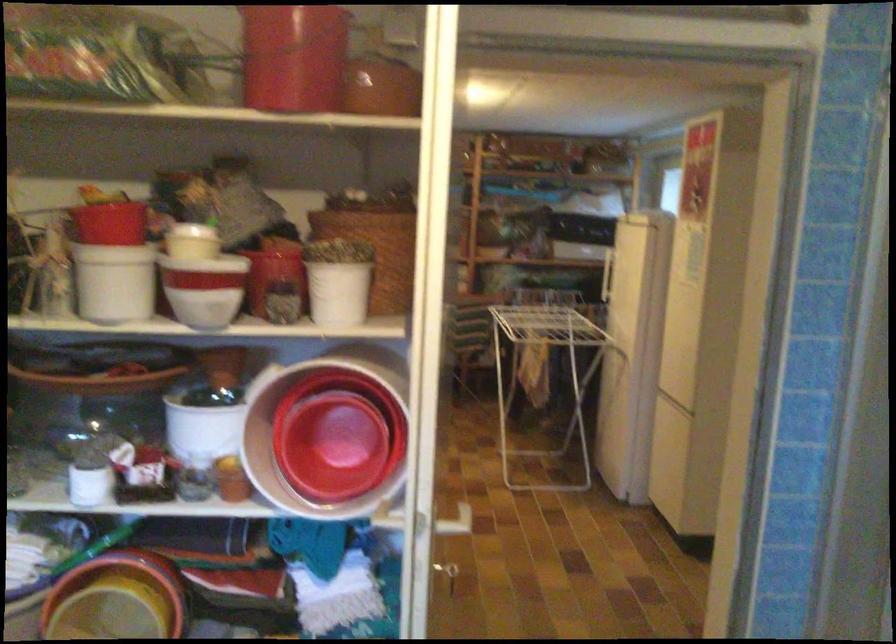
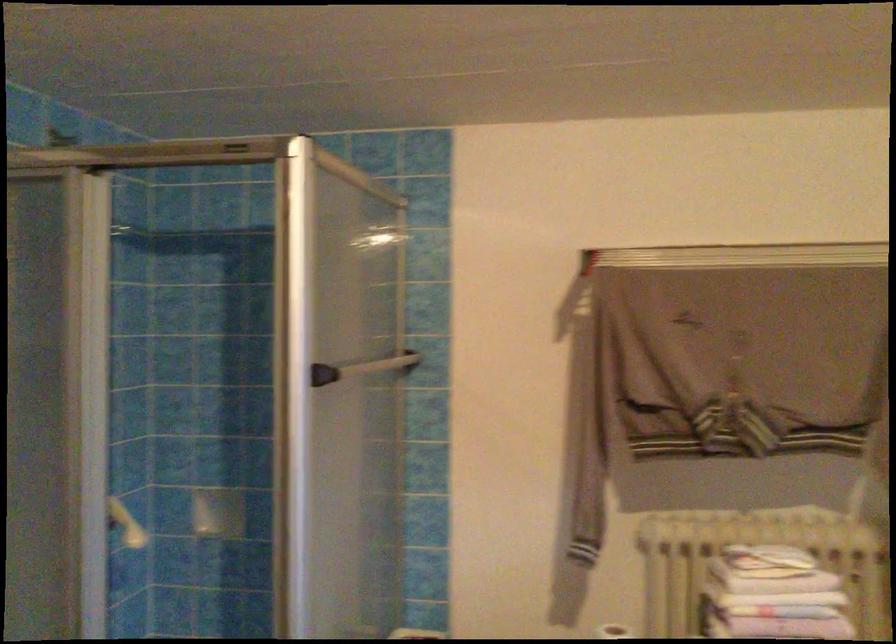
Question: The camera is either moving clockwise (left) or counter-clockwise (right) around the object. The first image is from the beginning of the video and the second image is from the end. Is the camera moving left or right when shooting the video?

Choices:
 (A) Left
 (B) Right

Answer: (A)